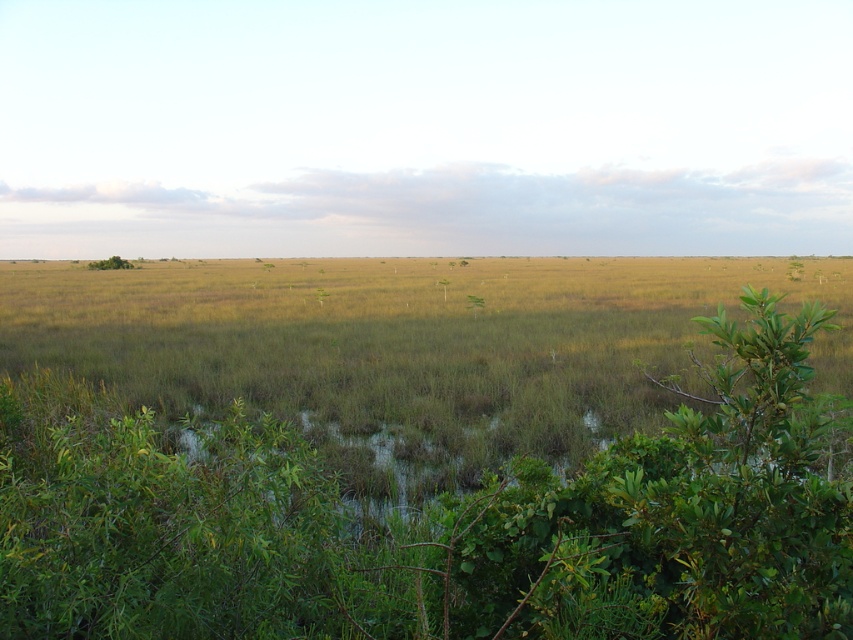
Where is the green grassy tree at center located in the image?

The green grassy tree at center is located at point (320, 296) in the image.